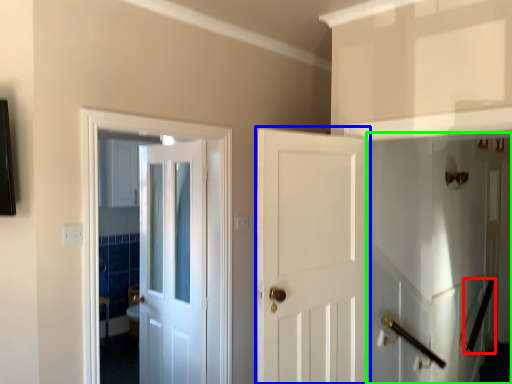
Question: Based on their relative distances, which object is farther from door handle (highlighted by a red box)? Choose from door (highlighted by a blue box) and elevator (highlighted by a green box).

Choices:
 (A) door
 (B) elevator

Answer: (A)